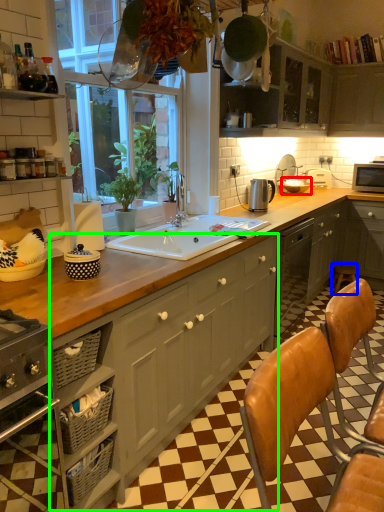
Question: Which is farther away from appliance (highlighted by a red box)? bar stool (highlighted by a blue box) or cabinetry (highlighted by a green box)?

Choices:
 (A) bar stool
 (B) cabinetry

Answer: (B)